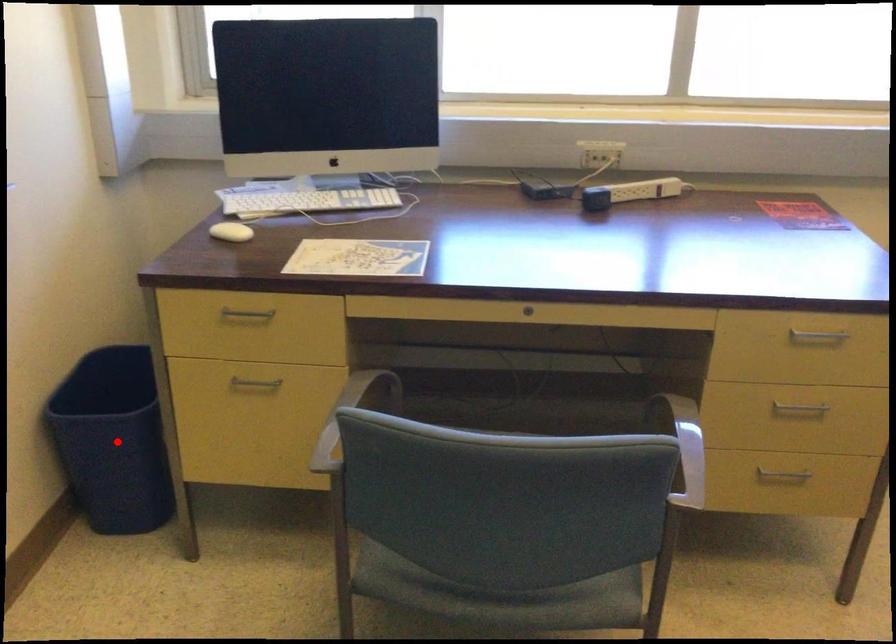
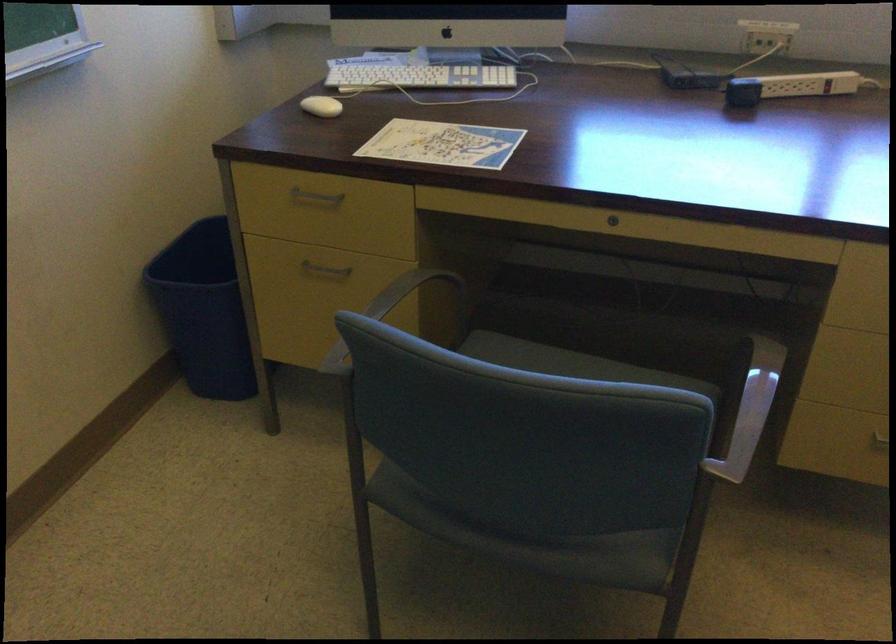
Locate, in the second image, the point that corresponds to the highlighted location in the first image.

(202, 310)